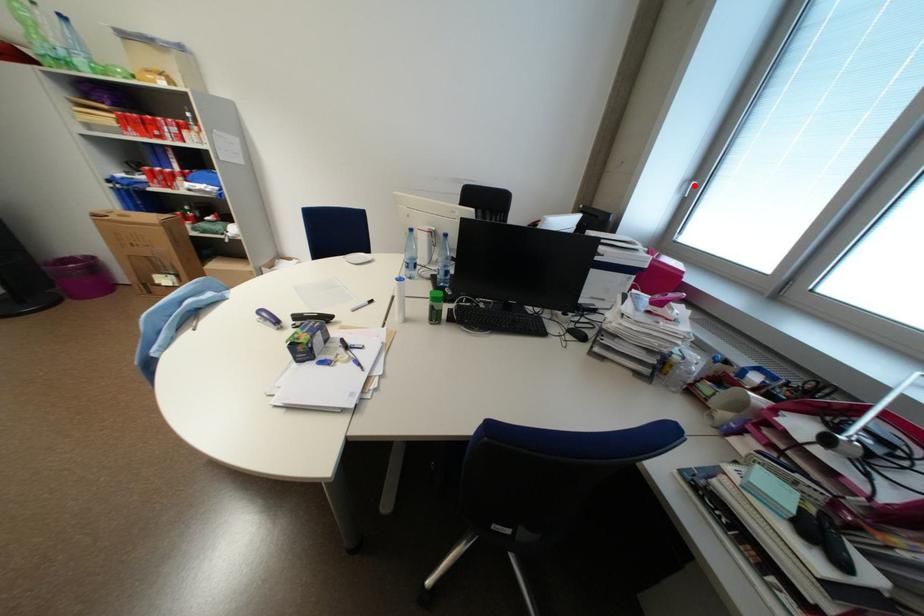
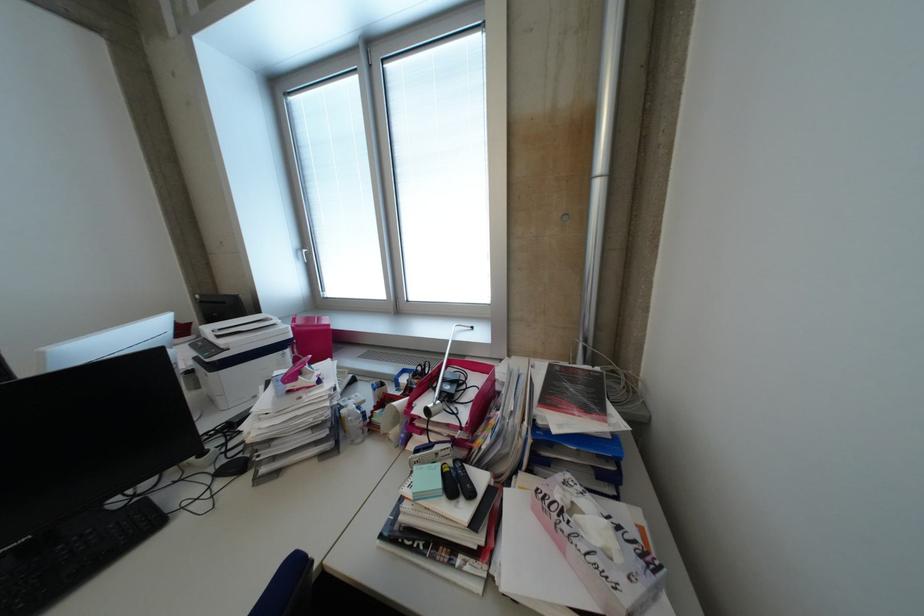
Question: I am providing you with two images of the same scene from different viewpoints. Given a red point in image1, look at the same physical point in image2. Is it:

Choices:
 (A) Closer to the viewpoint
 (B) Farther from the viewpoint

Answer: (A)